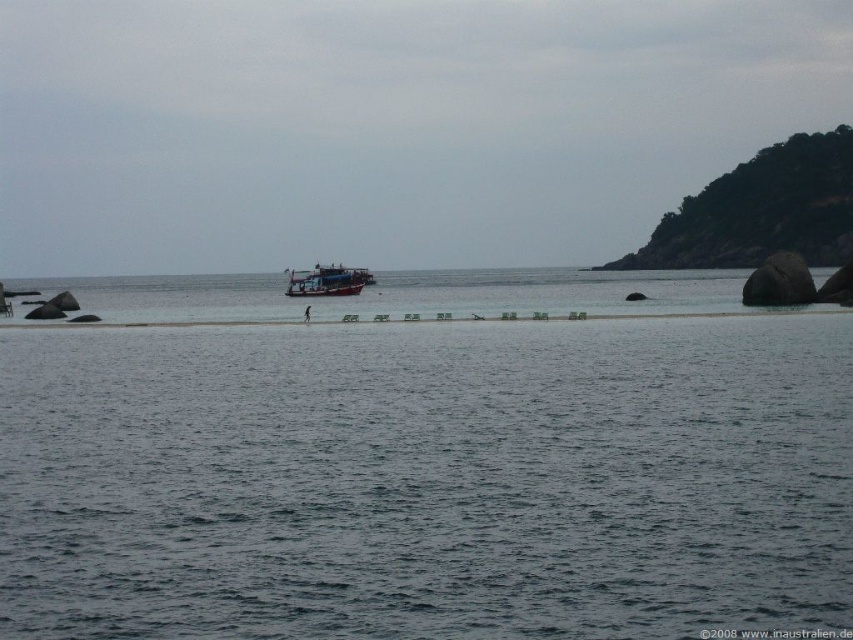
You are standing at point A located at coordinates (426, 480) in the coastal scene. What type of terrain or surface are you currently standing on?

At point A located at coordinates (426, 480) in the coastal scene, you are standing on dark blue water at center.